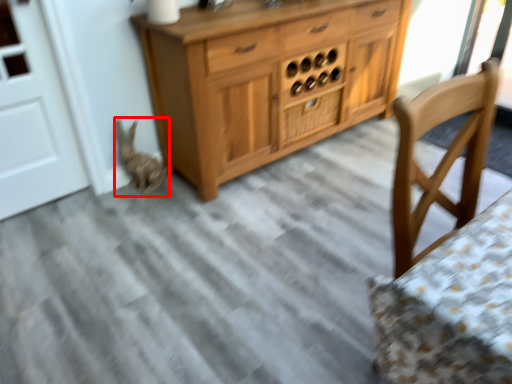
Question: Considering the relative positions of animal (annotated by the red box) and drawer in the image provided, where is animal (annotated by the red box) located with respect to the staircase?

Choices:
 (A) right
 (B) left

Answer: (B)